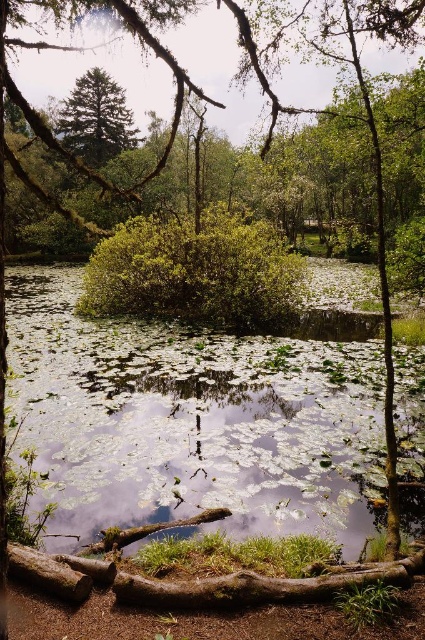
You are an environmental scientist assessing the pond ecosystem. You observe the green leafy water at center and the green matte tree at upper left. Which of these two elements has a greater horizontal spread in the image?

The green leafy water at center has a greater horizontal spread than the green matte tree at upper left because its width is larger according to the description.

You are standing at the edge of the pond and see two points marked in the scene. The first point is at coordinates point [84,474] and the second is at point [70,145]. Which point is closer to you?

Point [84,474] is in front of point [70,145], so the first point is closer to you.

You are standing at the edge of the pond and want to reach the green leafy water at center. Which direction should you move to get there?

The green leafy water at center is located at point (189, 419), so you should move towards the center of the pond to reach it.